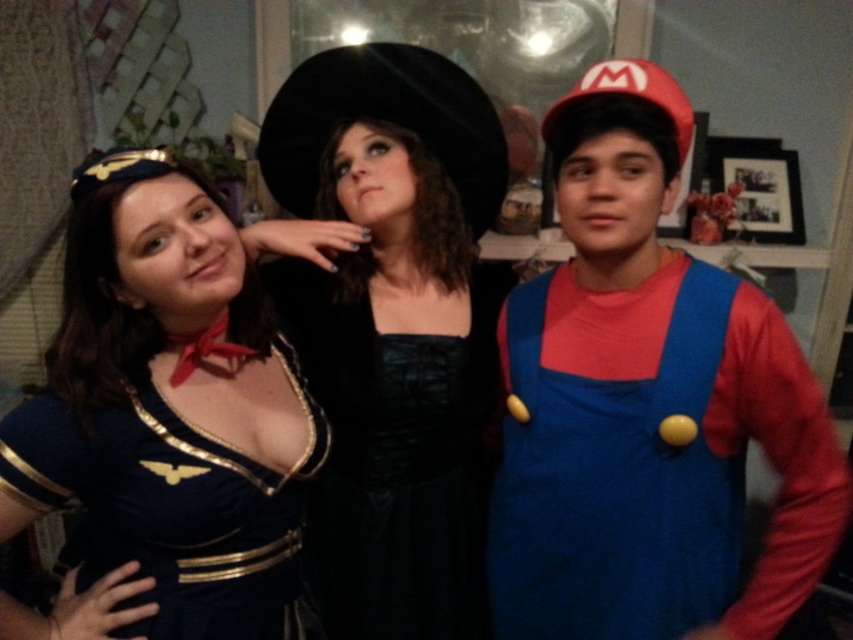
Is velvet black dress at center behind shiny blue fabric dress at center?

Yes, it is behind shiny blue fabric dress at center.

Can you confirm if velvet black dress at center is thinner than shiny blue fabric dress at center?

No, velvet black dress at center is not thinner than shiny blue fabric dress at center.

Who is more distant from viewer, (467, 262) or (148, 532)?

The point (467, 262) is behind.

Where is `velvet black dress at center`? The height and width of the screenshot is (640, 853). velvet black dress at center is located at coordinates (386, 323).

Can you confirm if velvet black dress at center is positioned to the right of black satin dress at center?

No, velvet black dress at center is not to the right of black satin dress at center.

Can you confirm if velvet black dress at center is shorter than black satin dress at center?

No, velvet black dress at center is not shorter than black satin dress at center.

Who is more forward, [320,205] or [332,552]?

Point [332,552]

Identify the location of velvet black dress at center. (386, 323).

Does velvet black dress at center have a greater width compared to blue fabric overalls at right?

In fact, velvet black dress at center might be narrower than blue fabric overalls at right.

Who is more forward, (422, 280) or (788, 408)?

Point (788, 408) is in front.

I want to click on velvet black dress at center, so click(x=386, y=323).